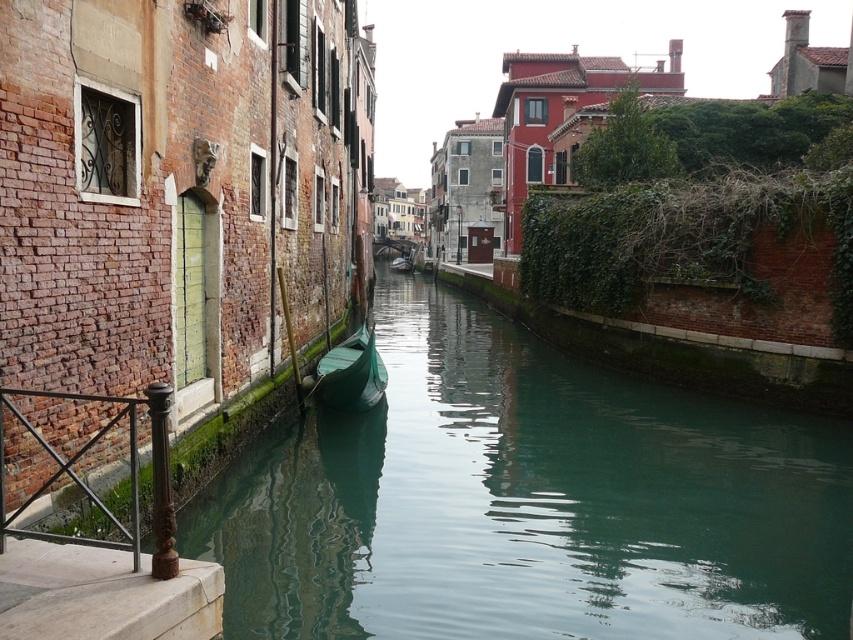
Is point (125, 531) behind point (334, 348)?

No, (125, 531) is closer to viewer.

Image resolution: width=853 pixels, height=640 pixels. Describe the element at coordinates (129, 476) in the screenshot. I see `brown wrought iron railing at lower left` at that location.

This screenshot has width=853, height=640. Identify the location of brown wrought iron railing at lower left. (129, 476).